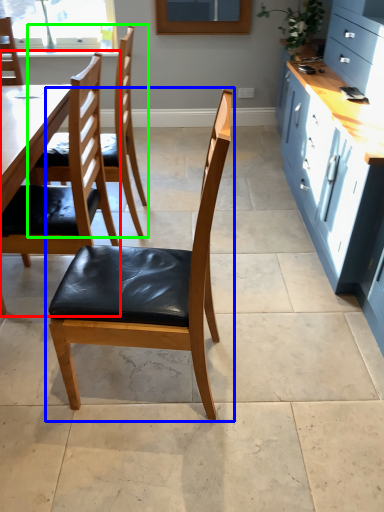
Question: Which is nearer to the chair (highlighted by a red box)? chair (highlighted by a blue box) or chair (highlighted by a green box).

Choices:
 (A) chair
 (B) chair

Answer: (A)